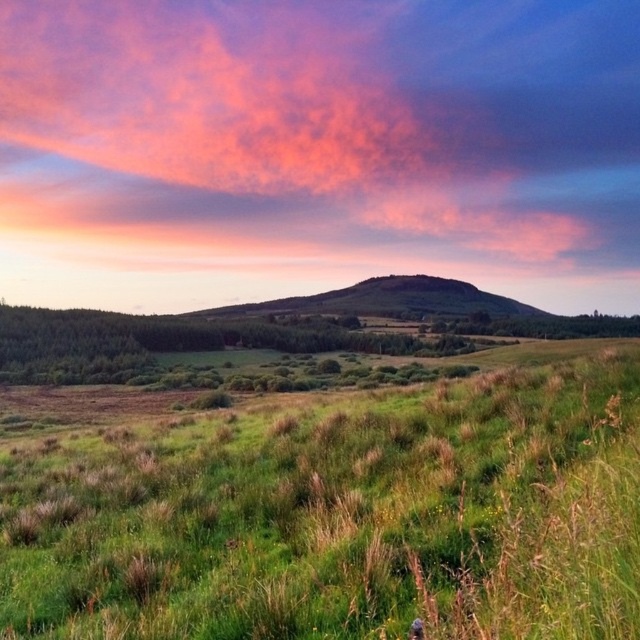
You are standing at the center of the image and want to walk towards the green grassy field at center. In which direction should you go?

The green grassy field at center is already at the center of the image, so you are already facing it. You don not need to change direction.

You are a photographer trying to capture the sunset. You notice the green grassy field at center and the pink fluffy cloud at upper center in your viewfinder. Which object should you focus on to ensure the sunset colors are properly highlighted in your photo?

The pink fluffy cloud at upper center should be focused on to highlight the sunset colors since it is positioned higher in the sky where the vibrant hues are most intense.

You are standing in a rural landscape with a green grassy field at center and a green grassy hillside at center. Which of the two has a larger area?

The green grassy hillside at center has a larger area than the green grassy field at center according to the description.